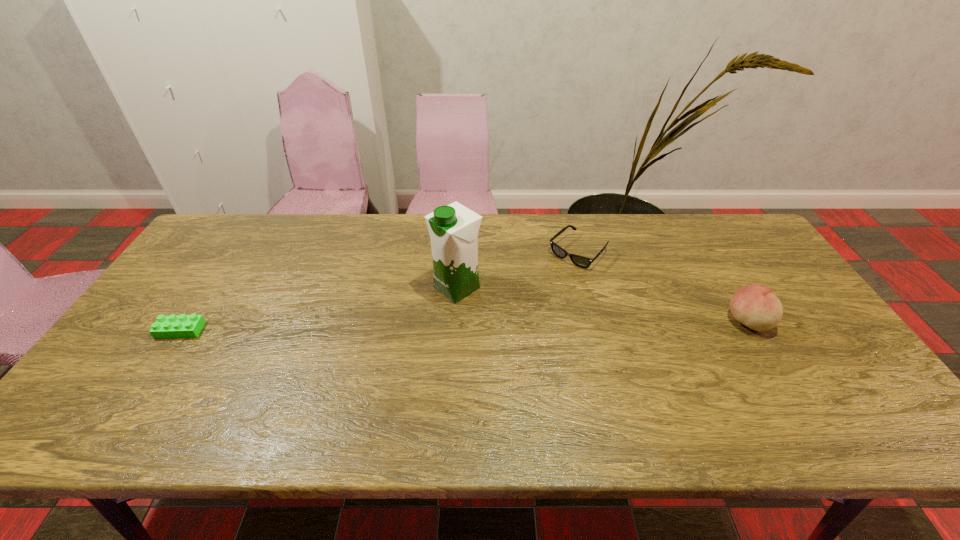
Locate an element on the screen. The image size is (960, 540). free spot on the desktop that is between the shortest object and the second tallest object and is positioned on the front-facing side of the sunglasses is located at coordinates (501, 325).

I want to click on vacant spot on the desktop that is between the Lego and the peach and is positioned on the front-facing side of the soya milk, so click(x=394, y=327).